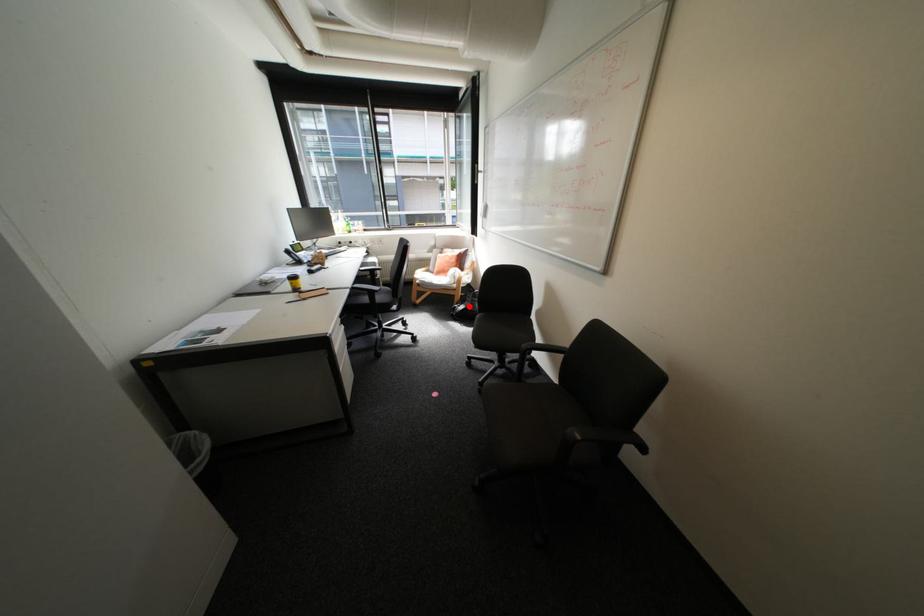
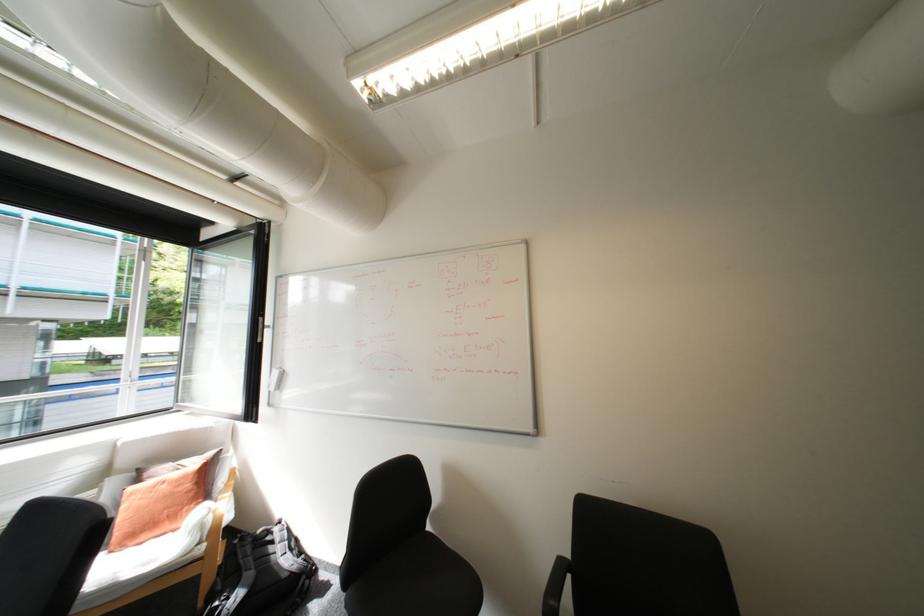
Question: I am providing you with two images of the same scene from different viewpoints. A red point is shown in image1. For the corresponding object point in image2, is it positioned nearer or farther from the camera?

Choices:
 (A) Nearer
 (B) Farther

Answer: (A)